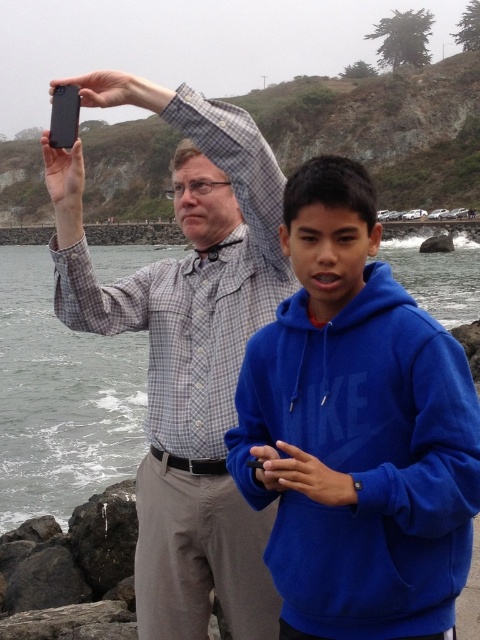
You are a photographer trying to capture a landscape shot of the scene. You notice the matte black shirt at upper left and the gray water at lower left in your frame. Which object occupies more horizontal space in the image?

The gray water at lower left occupies more horizontal space in the image since the matte black shirt at upper left has a lesser width compared to it.

You are a photographer trying to capture a group photo of the blue fleece hoodie at center and the matte black shirt at upper left. Based on their sizes in the frame, which person should you position closer to the camera to make them appear the same size in the photo?

The blue fleece hoodie at center is smaller than the matte black shirt at upper left. To make them appear the same size in the photo, position the blue fleece hoodie at center closer to the camera and the matte black shirt at upper left farther away.